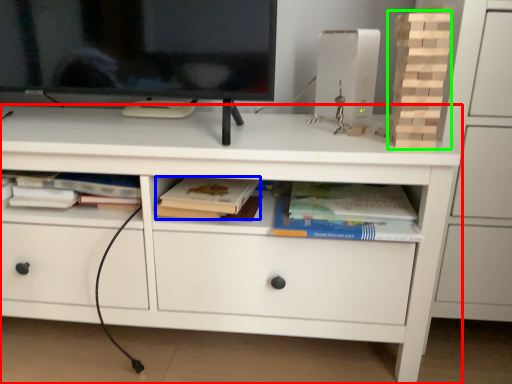
Question: Which object is positioned closest to chest of drawers (highlighted by a red box)? Select from paperback book (highlighted by a blue box) and book (highlighted by a green box).

Choices:
 (A) paperback book
 (B) book

Answer: (A)